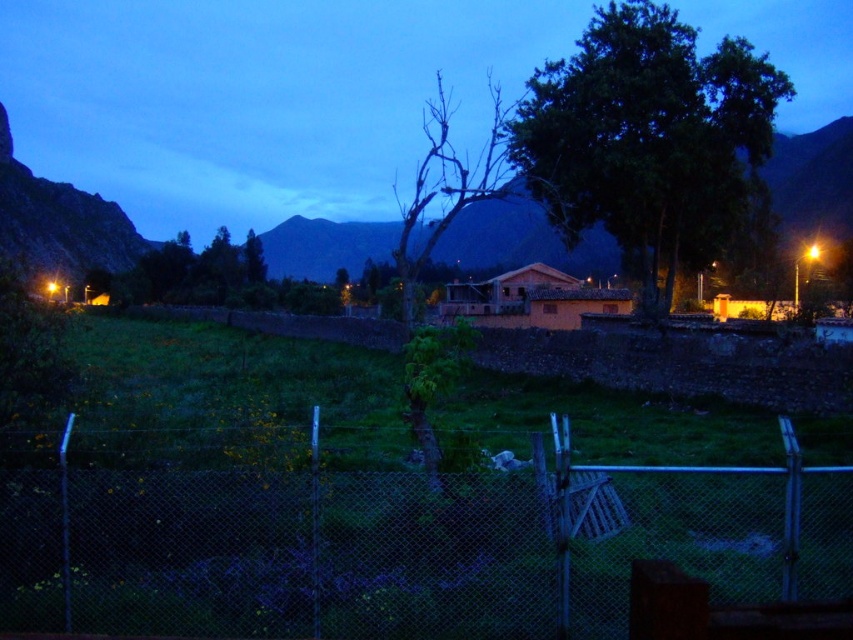
Question: Can you confirm if metal chain-link fence at lower center is positioned to the right of bare wood tree at center?

Choices:
 (A) yes
 (B) no

Answer: (A)

Question: Is metal chain-link fence at lower center to the right of green leafy tree at center from the viewer's perspective?

Choices:
 (A) yes
 (B) no

Answer: (B)

Question: Which of these objects is positioned closest to the metal chain-link fence at lower center?

Choices:
 (A) green leafy tree at upper center
 (B) bare wood tree at center
 (C) green leafy tree at center

Answer: (C)

Question: Which object appears farthest from the camera in this image?

Choices:
 (A) green leafy tree at upper center
 (B) green leafy tree at center
 (C) bare wood tree at center

Answer: (A)

Question: Among these points, which one is nearest to the camera?

Choices:
 (A) click(421, 209)
 (B) click(523, 116)
 (C) click(258, 282)
 (D) click(90, 544)

Answer: (D)

Question: Can you confirm if bare wood tree at center is positioned above green leafy tree at upper center?

Choices:
 (A) yes
 (B) no

Answer: (A)